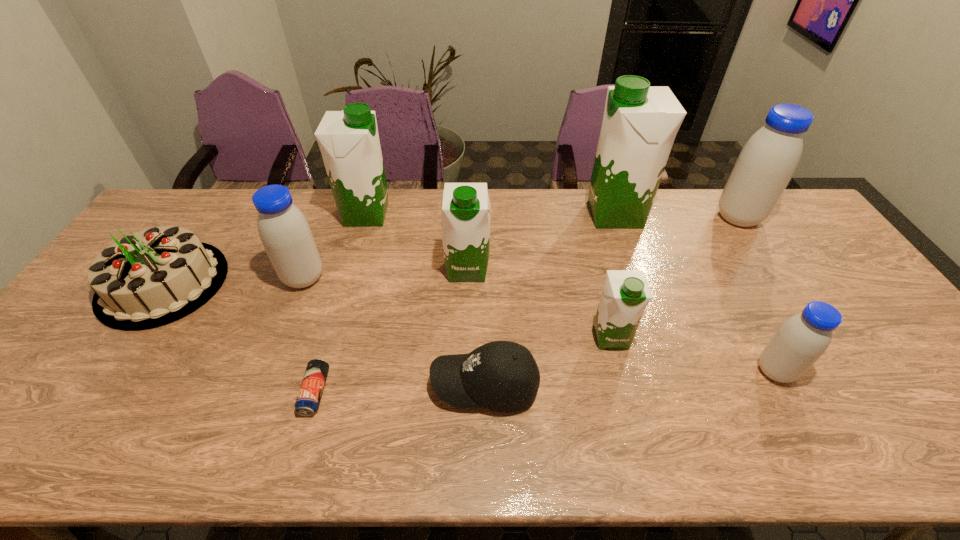
Where is `free point located 0.160m on the front-facing side of the ninth tallest object`? The height and width of the screenshot is (540, 960). free point located 0.160m on the front-facing side of the ninth tallest object is located at coordinates (364, 385).

Locate an element on the screen. This screenshot has width=960, height=540. vacant space situated on the front-facing side of the ninth tallest object is located at coordinates (411, 385).

I want to click on vacant space positioned 0.170m on the left of the beer can, so click(x=232, y=392).

Where is `object at the left edge`? object at the left edge is located at coordinates (151, 278).

What are the coordinates of `object that is at the right edge` in the screenshot? It's located at (768, 160).

Where is `object that is at the far right corner`? This screenshot has height=540, width=960. object that is at the far right corner is located at coordinates (768, 160).

In the image, there is a desktop. Identify the location of vacant space at the far edge. (729, 225).

This screenshot has width=960, height=540. In the image, there is a desktop. What are the coordinates of `vacant space at the near edge` in the screenshot? It's located at (513, 439).

Where is `vacant area at the left edge`? The height and width of the screenshot is (540, 960). vacant area at the left edge is located at coordinates [80, 395].

Locate an element on the screen. vacant space at the right edge is located at coordinates (837, 308).